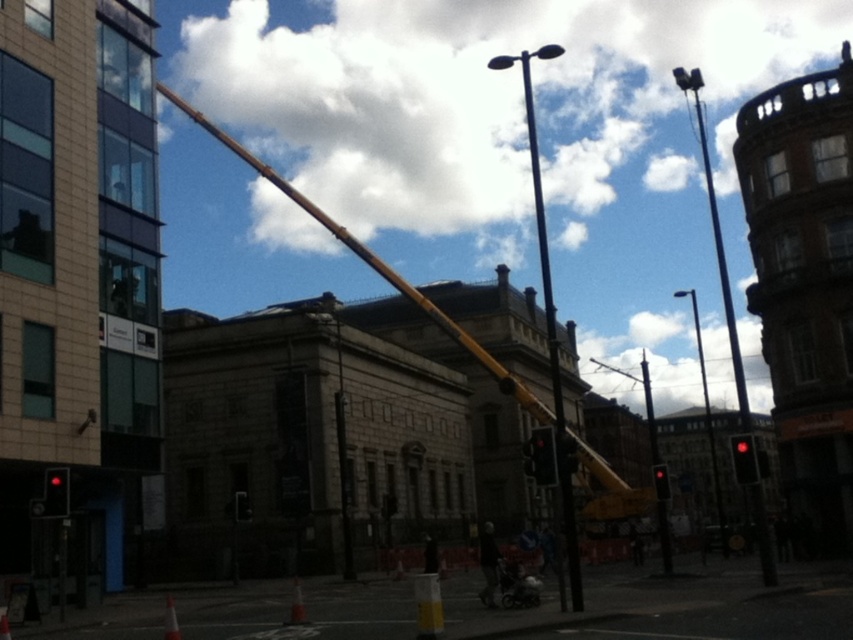
Question: Among these points, which one is nearest to the camera?

Choices:
 (A) (398, 285)
 (B) (1, 628)

Answer: (B)

Question: Which object appears farthest from the camera in this image?

Choices:
 (A) red matte traffic light at right
 (B) orange plastic cone at center

Answer: (A)

Question: Is the position of black plastic traffic light at center more distant than that of orange traffic cone at lower left?

Choices:
 (A) yes
 (B) no

Answer: (A)

Question: Which point is closer to the camera?

Choices:
 (A) (648, 403)
 (B) (387, 192)
 (C) (718, 529)

Answer: (C)

Question: Is white fluffy cloud at upper center smaller than orange traffic cone at lower left?

Choices:
 (A) yes
 (B) no

Answer: (B)

Question: Is polished metal street light at center wider than orange plastic cone at center?

Choices:
 (A) no
 (B) yes

Answer: (B)